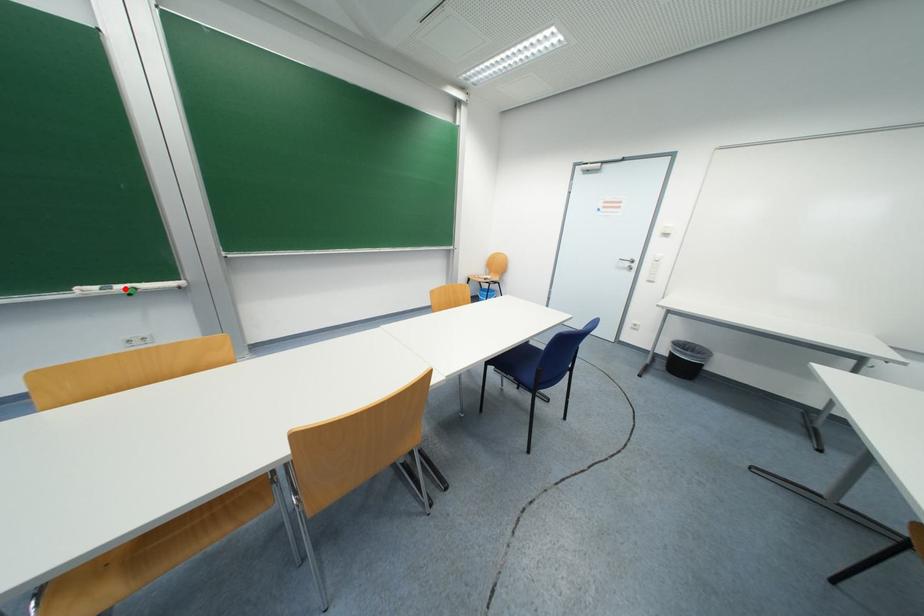
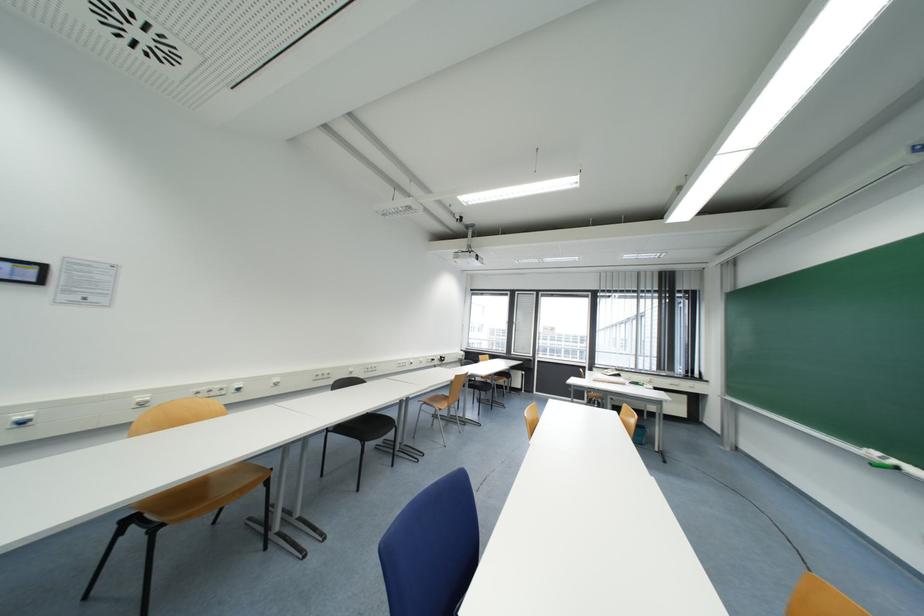
Where in the second image is the point corresponding to the highlighted location from the first image?

(898, 464)